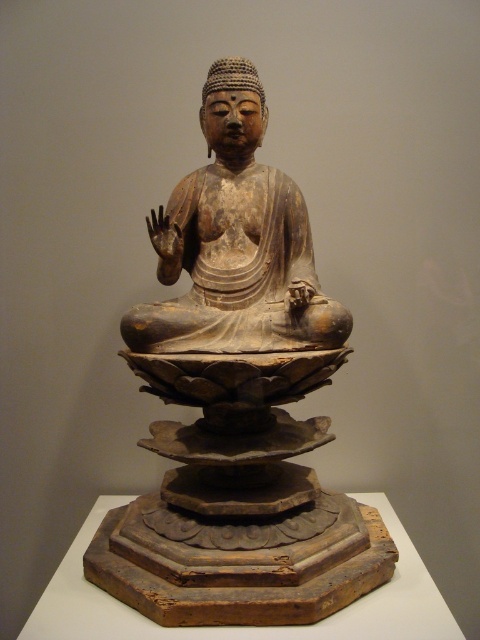
Question: Which point is closer to the camera?

Choices:
 (A) (250, 108)
 (B) (377, 582)

Answer: (B)

Question: From the image, what is the correct spatial relationship of matte brown wood statue at center in relation to wooden statue at center?

Choices:
 (A) above
 (B) below

Answer: (B)

Question: Among these objects, which one is farthest from the camera?

Choices:
 (A) matte brown wood statue at center
 (B) wooden statue at center

Answer: (B)

Question: Is matte brown wood statue at center positioned in front of wooden statue at center?

Choices:
 (A) yes
 (B) no

Answer: (A)

Question: Is matte brown wood statue at center to the right of wooden statue at center from the viewer's perspective?

Choices:
 (A) no
 (B) yes

Answer: (B)